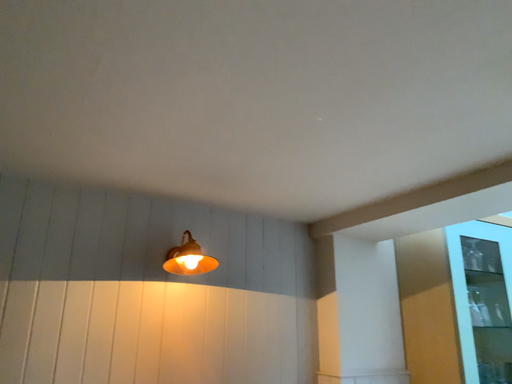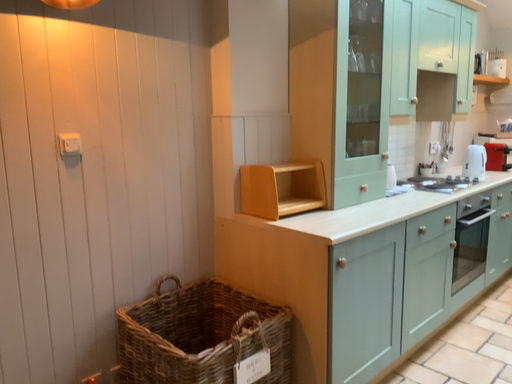
Question: How did the camera likely rotate when shooting the video?

Choices:
 (A) rotated right
 (B) rotated left

Answer: (A)